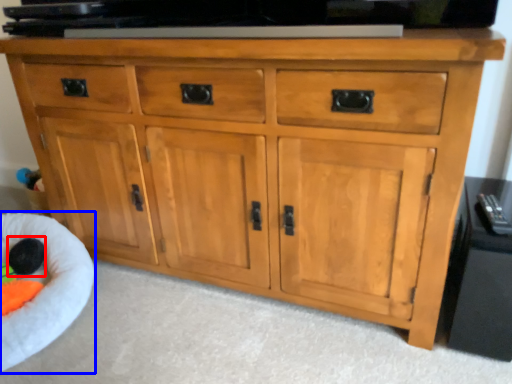
Question: Which point is closer to the camera, toy (highlighted by a red box) or infant bed (highlighted by a blue box)?

Choices:
 (A) toy
 (B) infant bed

Answer: (B)